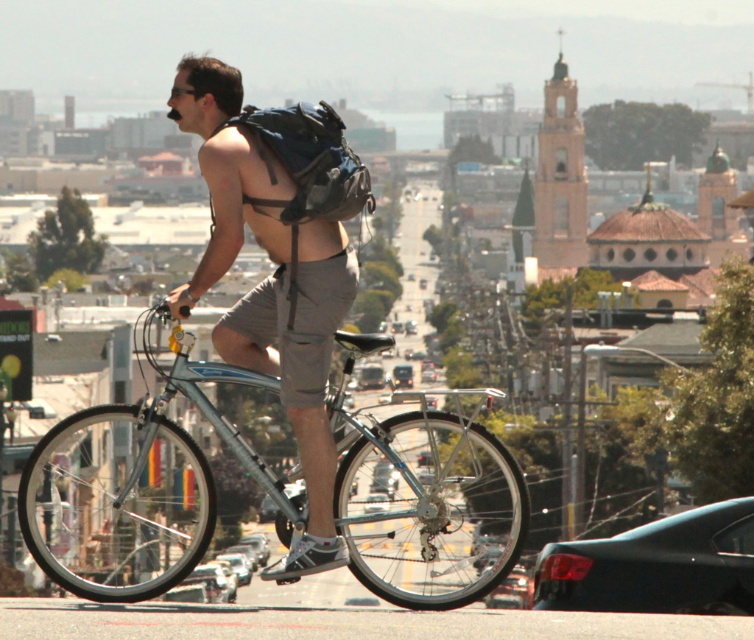
Question: Where is silver metallic bicycle at center located in relation to matte blue backpack at center in the image?

Choices:
 (A) right
 (B) left

Answer: (B)

Question: Which object is the farthest from the silver metallic bicycle at center?

Choices:
 (A) matte gray shorts at center
 (B) matte blue backpack at center
 (C) gray/knit shorts at center

Answer: (C)

Question: Estimate the real-world distances between objects in this image. Which object is closer to the silver metallic bicycle at center?

Choices:
 (A) matte blue backpack at center
 (B) gray/knit shorts at center
 (C) matte gray shorts at center

Answer: (A)

Question: Is matte gray shorts at center below matte blue backpack at center?

Choices:
 (A) yes
 (B) no

Answer: (A)

Question: Which of the following is the farthest from the observer?

Choices:
 (A) matte blue backpack at center
 (B) matte gray shorts at center
 (C) silver metallic bicycle at center

Answer: (A)

Question: Is silver metallic bicycle at center to the right of matte gray shorts at center from the viewer's perspective?

Choices:
 (A) no
 (B) yes

Answer: (A)